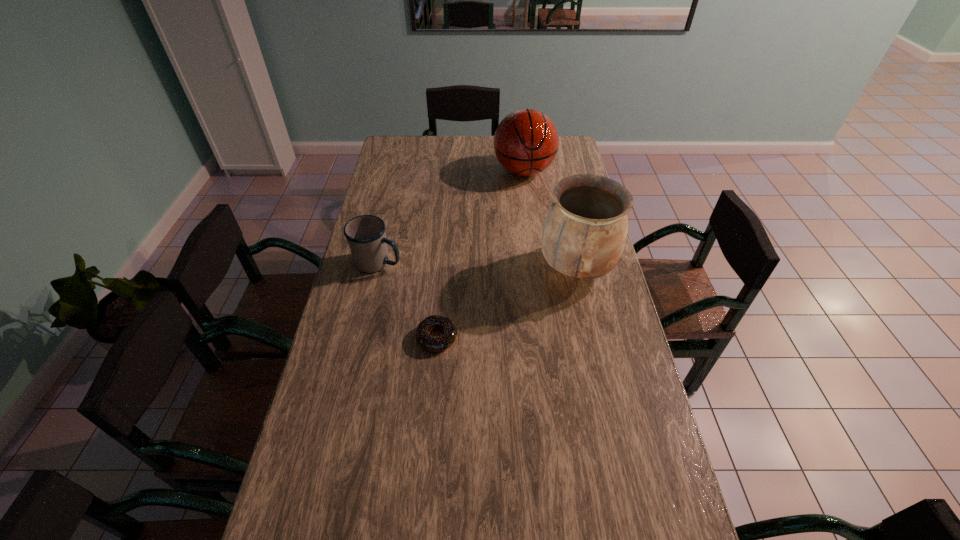
Where is `free space located on the side with spill of the basketball`? This screenshot has width=960, height=540. free space located on the side with spill of the basketball is located at coordinates (524, 220).

The image size is (960, 540). I want to click on free spot located 0.180m on the handle side of the third tallest object, so click(x=448, y=279).

Find the location of a particular element. This screenshot has height=540, width=960. free spot located 0.210m on the handle side of the third tallest object is located at coordinates (457, 281).

Where is `free space located on the handle side of the third tallest object`? free space located on the handle side of the third tallest object is located at coordinates (460, 282).

Find the location of a particular element. This screenshot has height=540, width=960. object at the far edge is located at coordinates (526, 141).

You are a GUI agent. You are given a task and a screenshot of the screen. Output one action in this format:
    pyautogui.click(x=<x>, y=<y>)
    Task: Click on the object present at the left edge
    
    Given the screenshot: What is the action you would take?
    pyautogui.click(x=366, y=236)

Locate an element on the screen. This screenshot has width=960, height=540. urn present at the right edge is located at coordinates (585, 230).

This screenshot has height=540, width=960. I want to click on basketball located in the right edge section of the desktop, so click(526, 141).

Locate an element on the screen. Image resolution: width=960 pixels, height=540 pixels. object at the far right corner is located at coordinates (526, 141).

I want to click on free space at the far edge of the desktop, so click(475, 161).